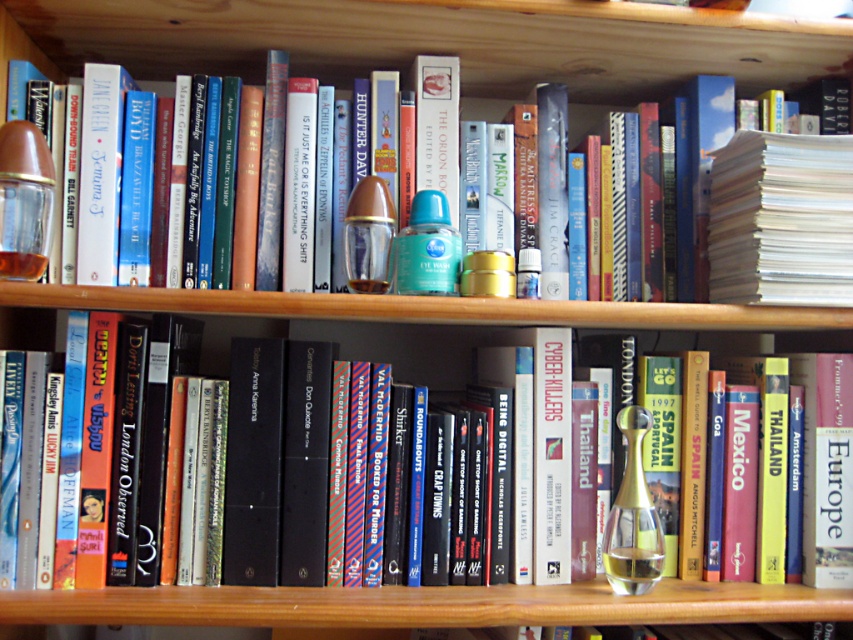
Is hardcover book at center behind matte glass perfume at left?

Yes, hardcover book at center is behind matte glass perfume at left.

Which is more to the left, hardcover book at center or matte glass perfume at left?

hardcover book at center is more to the left.

Identify the location of hardcover book at center. This screenshot has height=640, width=853. (367, 346).